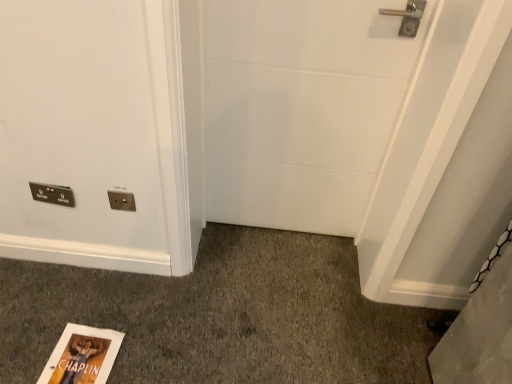
Question: Is white matte door at center further to the viewer compared to metallic silver light switch at lower left?

Choices:
 (A) no
 (B) yes

Answer: (A)

Question: Does white matte door at center appear on the left side of metallic silver light switch at lower left?

Choices:
 (A) no
 (B) yes

Answer: (A)

Question: From the image's perspective, does white matte door at center appear lower than metallic silver light switch at lower left?

Choices:
 (A) no
 (B) yes

Answer: (A)

Question: Does white matte door at center lie in front of metallic silver light switch at lower left?

Choices:
 (A) no
 (B) yes

Answer: (B)

Question: From a real-world perspective, is white matte door at center physically above metallic silver light switch at lower left?

Choices:
 (A) yes
 (B) no

Answer: (A)

Question: Can you confirm if white matte door at center is shorter than metallic silver light switch at lower left?

Choices:
 (A) no
 (B) yes

Answer: (A)

Question: Is metallic silver light switch at lower left shorter than white matte door at center?

Choices:
 (A) yes
 (B) no

Answer: (A)

Question: Considering the relative sizes of metallic silver light switch at lower left and white matte door at center in the image provided, is metallic silver light switch at lower left smaller than white matte door at center?

Choices:
 (A) no
 (B) yes

Answer: (B)

Question: Can you confirm if metallic silver light switch at lower left is bigger than white matte door at center?

Choices:
 (A) yes
 (B) no

Answer: (B)

Question: From the image's perspective, is metallic silver light switch at lower left on white matte door at center?

Choices:
 (A) yes
 (B) no

Answer: (B)

Question: Is metallic silver light switch at lower left to the left of white matte door at center from the viewer's perspective?

Choices:
 (A) no
 (B) yes

Answer: (B)

Question: Would you say metallic silver light switch at lower left is outside white matte door at center?

Choices:
 (A) no
 (B) yes

Answer: (B)

Question: Does white matte door at center have a lesser width compared to matte gold electrical outlet at center?

Choices:
 (A) yes
 (B) no

Answer: (B)